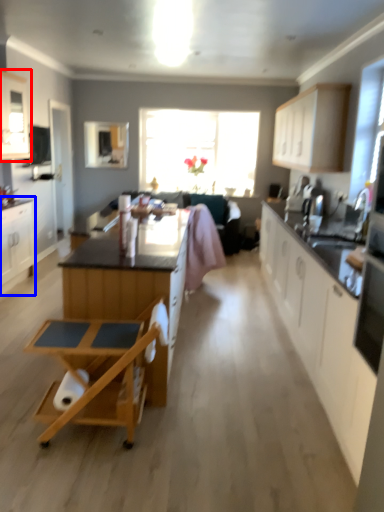
Question: Which object appears farthest to the camera in this image, cabinetry (highlighted by a red box) or cabinetry (highlighted by a blue box)?

Choices:
 (A) cabinetry
 (B) cabinetry

Answer: (B)